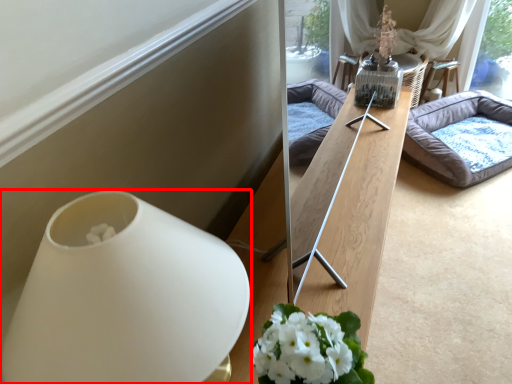
Question: Considering the relative positions of vase (annotated by the red box) and studio couch in the image provided, where is vase (annotated by the red box) located with respect to the staircase?

Choices:
 (A) left
 (B) right

Answer: (A)